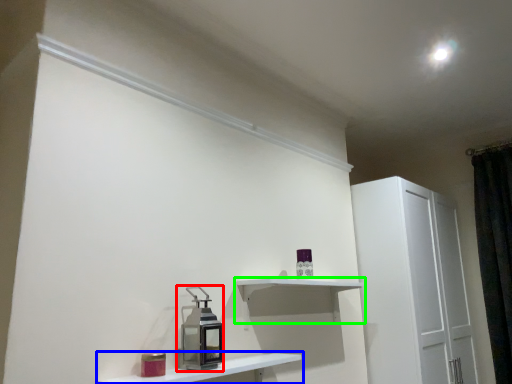
Question: Estimate the real-world distances between objects in this image. Which object is closer to appliance (highlighted by a red box), shelf (highlighted by a blue box) or shelf (highlighted by a green box)?

Choices:
 (A) shelf
 (B) shelf

Answer: (A)